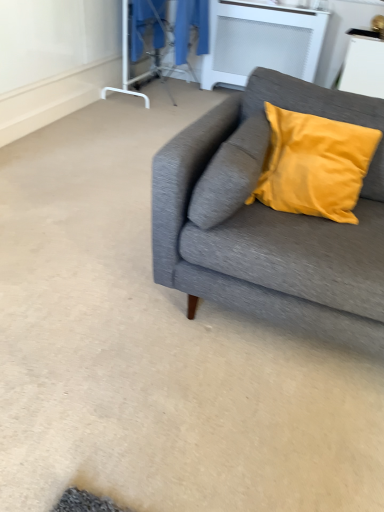
Question: Is transparent plastic screen door at upper center not within blue fabric laundry at upper center?

Choices:
 (A) yes
 (B) no

Answer: (B)

Question: Is transparent plastic screen door at upper center wider than blue fabric laundry at upper center?

Choices:
 (A) no
 (B) yes

Answer: (A)

Question: Is transparent plastic screen door at upper center at the right side of blue fabric laundry at upper center?

Choices:
 (A) no
 (B) yes

Answer: (A)

Question: Is transparent plastic screen door at upper center not close to blue fabric laundry at upper center?

Choices:
 (A) yes
 (B) no

Answer: (B)

Question: Is the surface of transparent plastic screen door at upper center in direct contact with blue fabric laundry at upper center?

Choices:
 (A) yes
 (B) no

Answer: (B)

Question: Is transparent plastic screen door at upper center to the left of blue fabric laundry at upper center from the viewer's perspective?

Choices:
 (A) no
 (B) yes

Answer: (B)

Question: Is white glossy table at upper right, arranged as the 1th table when viewed from the front, facing towards textured gray couch at right?

Choices:
 (A) yes
 (B) no

Answer: (B)

Question: Does white glossy table at upper right, positioned as the second table in left-to-right order, touch textured gray couch at right?

Choices:
 (A) yes
 (B) no

Answer: (B)

Question: Can you confirm if white glossy table at upper right, arranged as the first table when viewed from the right, is shorter than textured gray couch at right?

Choices:
 (A) yes
 (B) no

Answer: (A)

Question: Does white glossy table at upper right, arranged as the 1th table when viewed from the front, come behind textured gray couch at right?

Choices:
 (A) yes
 (B) no

Answer: (A)

Question: From a real-world perspective, is white glossy table at upper right, arranged as the first table when viewed from the right, located beneath textured gray couch at right?

Choices:
 (A) yes
 (B) no

Answer: (B)

Question: From the image's perspective, is white glossy table at upper right, which appears as the 2th table when viewed from the back, on textured gray couch at right?

Choices:
 (A) yes
 (B) no

Answer: (A)

Question: Is white matte radiator at upper center, which is the 2th table from front to back, facing towards white glossy table at upper right, which appears as the 2th table when viewed from the back?

Choices:
 (A) yes
 (B) no

Answer: (B)